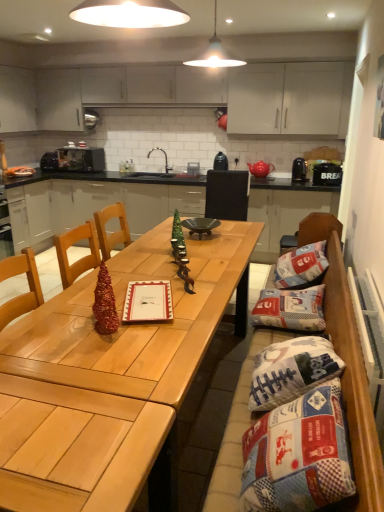
The image size is (384, 512). What do you see at coordinates (299, 170) in the screenshot?
I see `black plastic toaster at upper center, the 4th appliance viewed from the left` at bounding box center [299, 170].

What do you see at coordinates (291, 309) in the screenshot? I see `patchwork fabric pillow at lower right, which is counted as the 2th pillow, starting from the back` at bounding box center [291, 309].

Measure the distance between point (54, 169) and camera.

Point (54, 169) is 17.68 feet from camera.

Describe the element at coordinates (49, 161) in the screenshot. This screenshot has height=512, width=384. I see `black matte microwave at left, which is counted as the first appliance, starting from the left` at that location.

Locate an element on the screen. metallic black kettle at upper center, the 3th appliance from the left is located at coordinates coord(220,162).

Image resolution: width=384 pixels, height=512 pixels. Describe the element at coordinates (291, 371) in the screenshot. I see `patchwork fabric pillow at right, the 3th pillow in the back-to-front sequence` at that location.

In order to face patchwork fabric pillow at right, the 3th pillow in the back-to-front sequence, should I rotate leftwards or rightwards?

Turn right by 13.401 degrees to look at patchwork fabric pillow at right, the 3th pillow in the back-to-front sequence.

What is the approximate height of wooden chair at center?

The height of wooden chair at center is 3.88 feet.

This screenshot has height=512, width=384. In order to click on black plastic toaster at upper center, the 4th appliance viewed from the left in this screenshot , I will do `click(299, 170)`.

Is shiny metallic christmas tree at center, the second christmas tree from the top, far from black matte microwave at left, arranged as the 5th appliance when viewed from the right?

That's right, there is a large distance between shiny metallic christmas tree at center, the second christmas tree from the top, and black matte microwave at left, arranged as the 5th appliance when viewed from the right.

From the picture: How different are the orientations of shiny metallic christmas tree at center, acting as the second christmas tree starting from the back, and black matte microwave at left, arranged as the 5th appliance when viewed from the right, in degrees?

They differ by 53.5 degrees in their facing directions.

From a real-world perspective, which object rests below the other?

In real-world perspective, shiny metallic christmas tree at center, the second christmas tree from the top, is lower.

Does shiny metallic christmas tree at center, the 1th christmas tree viewed from the left, appear on the left side of black matte microwave at left, arranged as the 5th appliance when viewed from the right?

Incorrect, shiny metallic christmas tree at center, the 1th christmas tree viewed from the left, is not on the left side of black matte microwave at left, arranged as the 5th appliance when viewed from the right.

Which of these two, patchwork fabric pillow at right, the 3th pillow in the back-to-front sequence, or black matte sink at center, is wider?

With larger width is black matte sink at center.

This screenshot has width=384, height=512. In order to click on pillow that is the 3rd one when counting downward from the black matte sink at center (from the image's perspective) in this screenshot , I will do tap(291, 371).

Is patchwork fabric pillow at right, which ranks as the 1th pillow in front-to-back order, positioned with its back to black matte sink at center?

patchwork fabric pillow at right, which ranks as the 1th pillow in front-to-back order, is not turned away from black matte sink at center.

From the image's perspective, relative to black matte sink at center, is patchwork fabric pillow at right, which ranks as the 1th pillow in front-to-back order, above or below?

patchwork fabric pillow at right, which ranks as the 1th pillow in front-to-back order, is situated lower than black matte sink at center in the image.

From a real-world perspective, is black plastic bread bin at right, arranged as the first appliance when viewed from the right, positioned under patchwork fabric bean bag chair at center based on gravity?

Actually, black plastic bread bin at right, arranged as the first appliance when viewed from the right, is physically above patchwork fabric bean bag chair at center in the real world.

Is black plastic bread bin at right, arranged as the first appliance when viewed from the right, positioned far away from patchwork fabric bean bag chair at center?

black plastic bread bin at right, arranged as the first appliance when viewed from the right, is far away from patchwork fabric bean bag chair at center.

Considering the sizes of objects black plastic bread bin at right, placed as the 5th appliance when sorted from left to right, and patchwork fabric bean bag chair at center in the image provided, who is smaller, black plastic bread bin at right, placed as the 5th appliance when sorted from left to right, or patchwork fabric bean bag chair at center?

black plastic bread bin at right, placed as the 5th appliance when sorted from left to right, is smaller.

How different are the orientations of black plastic bread bin at right, placed as the 5th appliance when sorted from left to right, and patchwork fabric bean bag chair at center in degrees?

The angular difference between black plastic bread bin at right, placed as the 5th appliance when sorted from left to right, and patchwork fabric bean bag chair at center is 91.4 degrees.

Looking at the image, does patchwork fabric pillow at lower right, which is the 2th pillow in front-to-back order, seem bigger or smaller compared to metallic black kettle at upper center, the 3th appliance from the left?

In the image, patchwork fabric pillow at lower right, which is the 2th pillow in front-to-back order, appears to be larger than metallic black kettle at upper center, the 3th appliance from the left.

Is patchwork fabric pillow at lower right, which is counted as the 2th pillow, starting from the back, directly adjacent to metallic black kettle at upper center, placed as the 3th appliance when sorted from right to left?

patchwork fabric pillow at lower right, which is counted as the 2th pillow, starting from the back, and metallic black kettle at upper center, placed as the 3th appliance when sorted from right to left, are not in contact.

Can you tell me how much patchwork fabric pillow at lower right, which is counted as the 2th pillow, starting from the back, and metallic black kettle at upper center, placed as the 3th appliance when sorted from right to left, differ in facing direction?

90.4 degrees separate the facing orientations of patchwork fabric pillow at lower right, which is counted as the 2th pillow, starting from the back, and metallic black kettle at upper center, placed as the 3th appliance when sorted from right to left.

Based on the photo, from their relative heights in the image, would you say patchwork fabric pillow at lower right, which is the 2th pillow in front-to-back order, is taller or shorter than metallic black kettle at upper center, placed as the 3th appliance when sorted from right to left?

Clearly, patchwork fabric pillow at lower right, which is the 2th pillow in front-to-back order, is taller compared to metallic black kettle at upper center, placed as the 3th appliance when sorted from right to left.

From a real-world perspective, relative to metallic black kettle at upper center, placed as the 3th appliance when sorted from right to left, is wooden table at center vertically above or below?

wooden table at center is situated lower than metallic black kettle at upper center, placed as the 3th appliance when sorted from right to left, in the real world.

Would you say wooden table at center is inside or outside metallic black kettle at upper center, the 3th appliance from the left?

wooden table at center is located beyond the bounds of metallic black kettle at upper center, the 3th appliance from the left.

Is wooden table at center positioned with its back to metallic black kettle at upper center, placed as the 3th appliance when sorted from right to left?

That's not correct — wooden table at center is not looking away from metallic black kettle at upper center, placed as the 3th appliance when sorted from right to left.

Is black matte microwave at left, which is counted as the first appliance, starting from the left, aimed at black plastic bread bin at right, arranged as the first appliance when viewed from the right?

No.

From the black plastic bread bin at right, placed as the 5th appliance when sorted from left to right, count 2nd appliances backward and point to it. Please provide its 2D coordinates.

[(49, 161)]

Is black matte microwave at left, arranged as the 5th appliance when viewed from the right, touching black plastic bread bin at right, placed as the 5th appliance when sorted from left to right?

No, black matte microwave at left, arranged as the 5th appliance when viewed from the right, is not in contact with black plastic bread bin at right, placed as the 5th appliance when sorted from left to right.

Consider the image. Does black matte microwave at left, which is counted as the first appliance, starting from the left, have a greater height compared to black plastic bread bin at right, placed as the 5th appliance when sorted from left to right?

Incorrect, the height of black matte microwave at left, which is counted as the first appliance, starting from the left, is not larger of that of black plastic bread bin at right, placed as the 5th appliance when sorted from left to right.

From the image's perspective, which one is positioned higher, metallic black kettle at upper center, placed as the 3th appliance when sorted from right to left, or wooden table at center?

metallic black kettle at upper center, placed as the 3th appliance when sorted from right to left, is shown above in the image.

Which object is thinner, metallic black kettle at upper center, placed as the 3th appliance when sorted from right to left, or wooden table at center?

With smaller width is metallic black kettle at upper center, placed as the 3th appliance when sorted from right to left.

Can you see metallic black kettle at upper center, the 3th appliance from the left, touching wooden table at center?

No, metallic black kettle at upper center, the 3th appliance from the left, is not next to wooden table at center.

Considering the relative sizes of metallic black kettle at upper center, the 3th appliance from the left, and wooden table at center in the image provided, is metallic black kettle at upper center, the 3th appliance from the left, smaller than wooden table at center?

Yes.

From the image's perspective, starting from the black matte microwave at left, arranged as the 5th appliance when viewed from the right, which christmas tree is the 2nd one below? Please provide its 2D coordinates.

[(105, 303)]

From the black matte sink at center, count 1st pillow to the right and point to it. Please provide its 2D coordinates.

[(291, 371)]

Based on the photo, looking at the image, which one is located closer to black plastic toaster at upper center, which is counted as the second appliance, starting from the right, patchwork fabric pillow at right, which is counted as the first pillow, starting from the back, or metallic microwave at upper left, the fourth appliance in the right-to-left sequence?

patchwork fabric pillow at right, which is counted as the first pillow, starting from the back, is closer to black plastic toaster at upper center, which is counted as the second appliance, starting from the right.

Looking at the image, which one is located further to patchwork fabric pillow at lower right, which is the 2th pillow in front-to-back order, green matte christmas tree at center, the 1th christmas tree in the top-to-bottom sequence, or patchwork fabric bean bag chair at center?

green matte christmas tree at center, the 1th christmas tree in the top-to-bottom sequence, lies further to patchwork fabric pillow at lower right, which is the 2th pillow in front-to-back order, than the other object.

From the image, which object appears to be farther from green matte christmas tree at center, the 1th christmas tree in the top-to-bottom sequence, patchwork fabric pillow at right, the 3th pillow in the back-to-front sequence, or black matte sink at center?

Among the two, black matte sink at center is located further to green matte christmas tree at center, the 1th christmas tree in the top-to-bottom sequence.

Based on the photo, from the image, which object appears to be nearer to patchwork fabric pillow at right, the 3th pillow in the back-to-front sequence, patchwork fabric bean bag chair at center or shiny metallic christmas tree at center, acting as the second christmas tree starting from the back?

patchwork fabric bean bag chair at center lies closer to patchwork fabric pillow at right, the 3th pillow in the back-to-front sequence, than the other object.

Based on their spatial positions, is shiny wood table at center or wooden chair at center closer to patchwork fabric pillow at lower right, which is the 2th pillow in front-to-back order?

shiny wood table at center lies closer to patchwork fabric pillow at lower right, which is the 2th pillow in front-to-back order, than the other object.

From the image, which object appears to be farther from black plastic bread bin at right, placed as the 5th appliance when sorted from left to right, patchwork fabric pillow at right, the 3th pillow positioned from the front, or patchwork fabric bean bag chair at center?

patchwork fabric bean bag chair at center is further to black plastic bread bin at right, placed as the 5th appliance when sorted from left to right.

From the image, which object appears to be farther from shiny metallic christmas tree at center, placed as the 2th christmas tree when sorted from right to left, black plastic bread bin at right, arranged as the first appliance when viewed from the right, or metallic microwave at upper left, the fourth appliance in the right-to-left sequence?

metallic microwave at upper left, the fourth appliance in the right-to-left sequence, is positioned further to the anchor shiny metallic christmas tree at center, placed as the 2th christmas tree when sorted from right to left.

Estimate the real-world distances between objects in this image. Which object is closer to black plastic toaster at upper center, the 4th appliance viewed from the left, black matte sink at center or wooden table at center?

black matte sink at center is closer to black plastic toaster at upper center, the 4th appliance viewed from the left.

I want to click on sink between wooden chair at center and black matte microwave at left, which is counted as the first appliance, starting from the left, from front to back, so click(x=170, y=169).

Identify the location of cabinetry positioned between wooden chair at center and metallic black kettle at upper center, placed as the 3th appliance when sorted from right to left, from near to far. Image resolution: width=384 pixels, height=512 pixels. (95, 203).

Locate an element on the screen. The width and height of the screenshot is (384, 512). chair located between green matte christmas tree at center, the first christmas tree when ordered from right to left, and metallic microwave at upper left, the second appliance when ordered from left to right, in the depth direction is located at coordinates (227, 195).

This screenshot has width=384, height=512. I want to click on cabinetry positioned between patchwork fabric bean bag chair at center and black matte microwave at left, which is counted as the first appliance, starting from the left, from near to far, so click(95, 203).